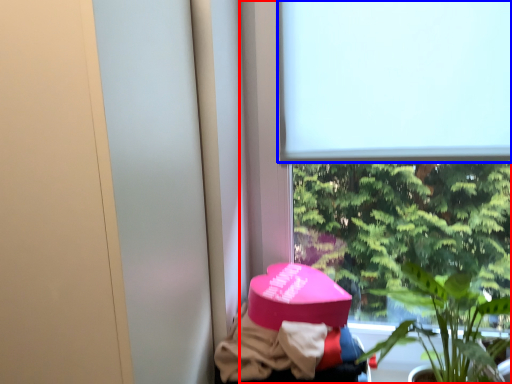
Question: Which object is closer to the camera taking this photo, window (highlighted by a red box) or window screen (highlighted by a blue box)?

Choices:
 (A) window
 (B) window screen

Answer: (A)